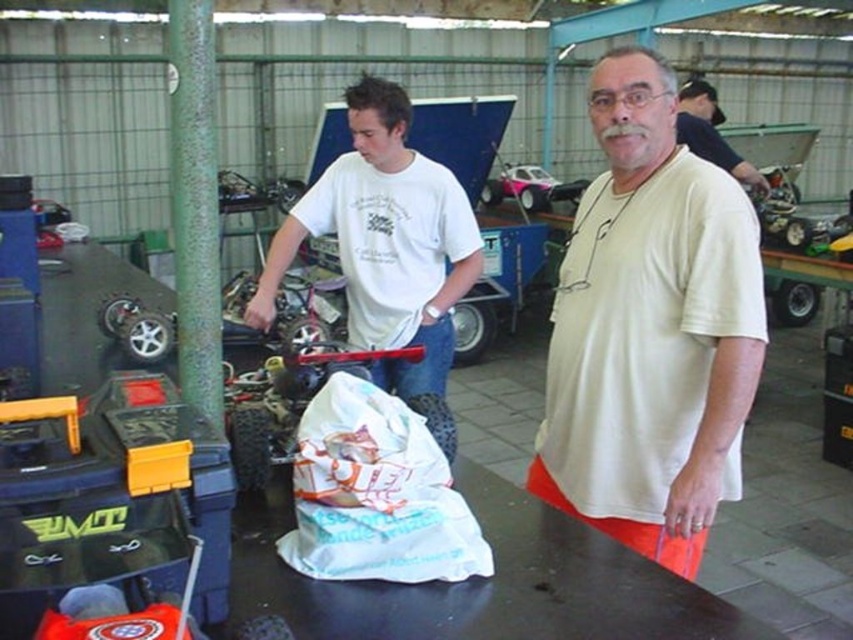
In the scene shown: You are standing in the workshop and see the point marked at coordinates [376,493]. What object is located at that point?

The white paper bag at center is located at the point marked at coordinates [376,493].

You are standing in the workshop and see the white paper bag at center and the dark blue shirt at upper right. Which object is located higher up in the image?

The dark blue shirt at upper right is located higher up in the image than the white paper bag at center.